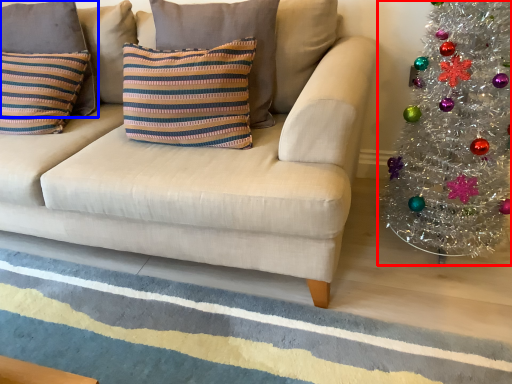
Question: Among these objects, which one is nearest to the camera, christmas tree (highlighted by a red box) or pillow (highlighted by a blue box)?

Choices:
 (A) christmas tree
 (B) pillow

Answer: (A)